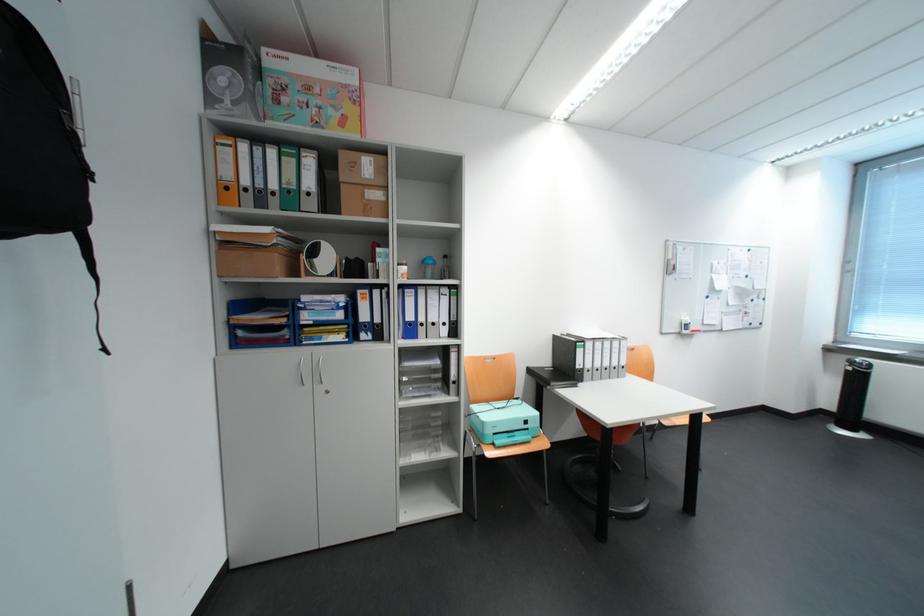
Identify the location of white binder. (590, 355).